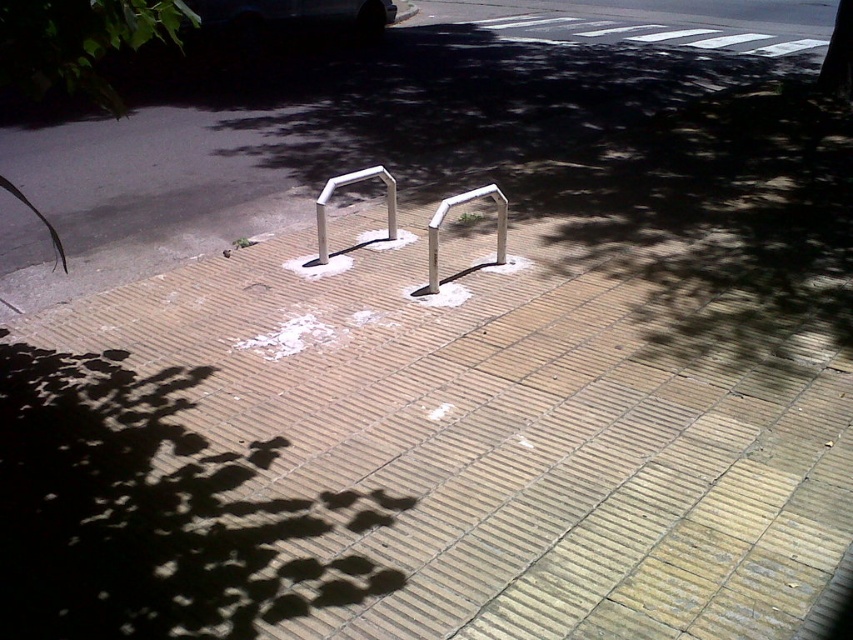
Question: Which point appears farthest from the camera in this image?

Choices:
 (A) (329, 192)
 (B) (502, 232)
 (C) (685, 588)

Answer: (A)

Question: Based on their relative distances, which object is farther from the white metallic rail at center?

Choices:
 (A) brown brick pavement at center
 (B) silver metallic rail at center

Answer: (A)

Question: Is brown brick pavement at center positioned behind white metallic rail at center?

Choices:
 (A) no
 (B) yes

Answer: (A)

Question: Can you confirm if brown brick pavement at center is bigger than silver metallic rail at center?

Choices:
 (A) no
 (B) yes

Answer: (B)

Question: Does brown brick pavement at center have a lesser width compared to silver metallic rail at center?

Choices:
 (A) no
 (B) yes

Answer: (A)

Question: Which object appears farthest from the camera in this image?

Choices:
 (A) silver metallic rail at center
 (B) brown brick pavement at center
 (C) white metallic rail at center

Answer: (A)